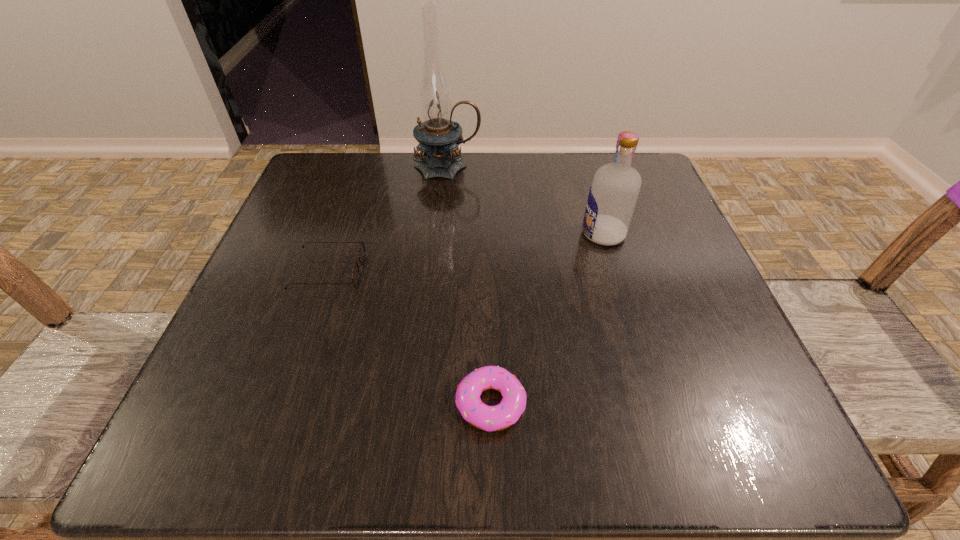
I want to click on vacant space at the right edge of the desktop, so click(x=703, y=284).

You are a GUI agent. You are given a task and a screenshot of the screen. Output one action in this format:
    pyautogui.click(x=<x>, y=<y>)
    Task: Click on the vacant space at the far left corner of the desktop
    The image size is (960, 540).
    Given the screenshot: What is the action you would take?
    pyautogui.click(x=303, y=197)

Locate an element on the screen. The width and height of the screenshot is (960, 540). free space at the near left corner of the desktop is located at coordinates (289, 427).

This screenshot has width=960, height=540. In order to click on empty space between the second tallest object and the nearest object in this screenshot , I will do `click(547, 319)`.

At what (x,y) coordinates should I click in order to perform the action: click on empty space that is in between the sunglasses and the nearest object. Please return your answer as a coordinate pair (x, y). This screenshot has width=960, height=540. Looking at the image, I should click on (410, 338).

Where is `vacant area between the sunglasses and the rightmost object`? The width and height of the screenshot is (960, 540). vacant area between the sunglasses and the rightmost object is located at coordinates (466, 253).

Find the location of a particular element. The height and width of the screenshot is (540, 960). vacant point located between the tallest object and the nearest object is located at coordinates (469, 285).

Locate an element on the screen. The width and height of the screenshot is (960, 540). blank region between the sunglasses and the nearest object is located at coordinates (410, 338).

Where is `vacant space in between the farthest object and the nearest object`? vacant space in between the farthest object and the nearest object is located at coordinates (469, 285).

Where is `empty space between the rightmost object and the tallest object`? The width and height of the screenshot is (960, 540). empty space between the rightmost object and the tallest object is located at coordinates (525, 200).